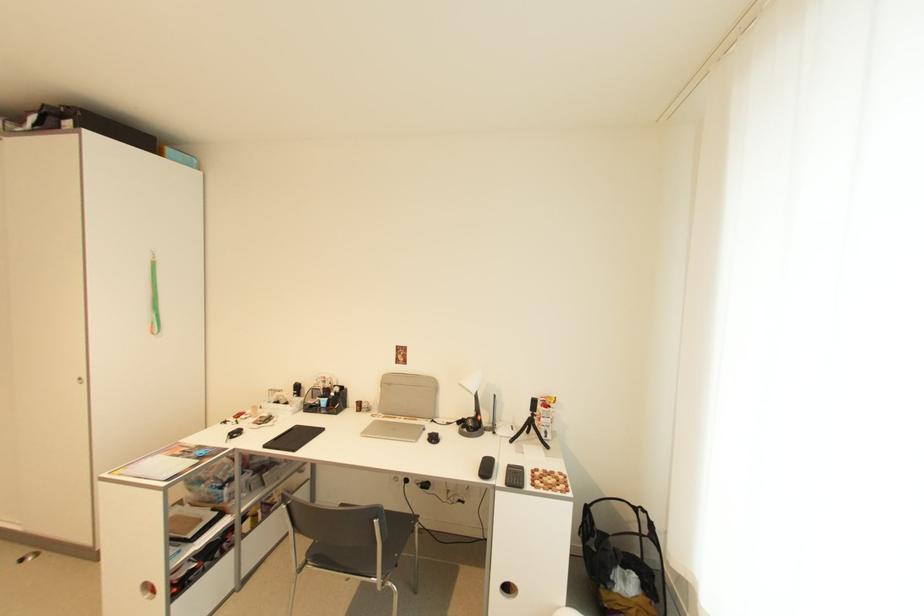
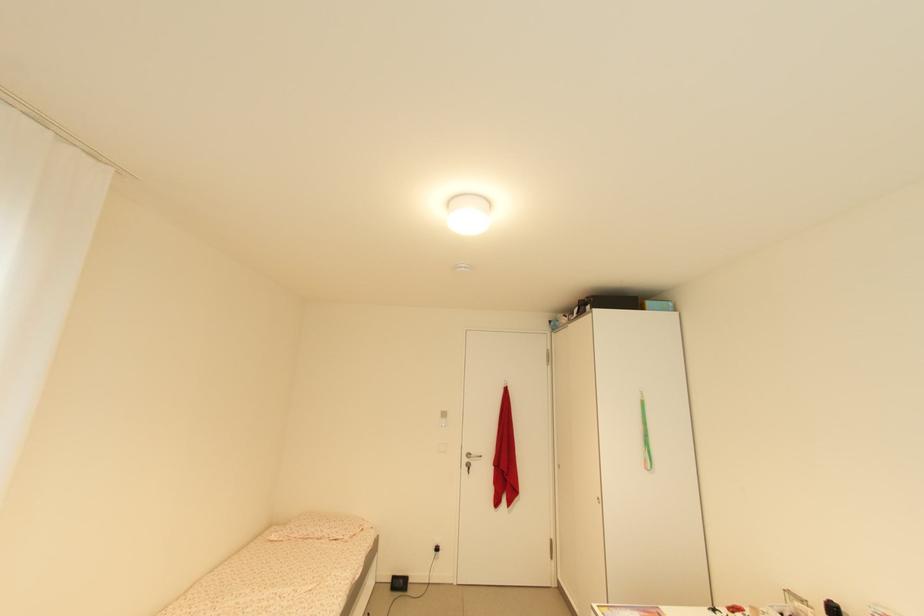
Where in the second image is the point corresponding to the point at 74,108 from the first image?

(592, 299)